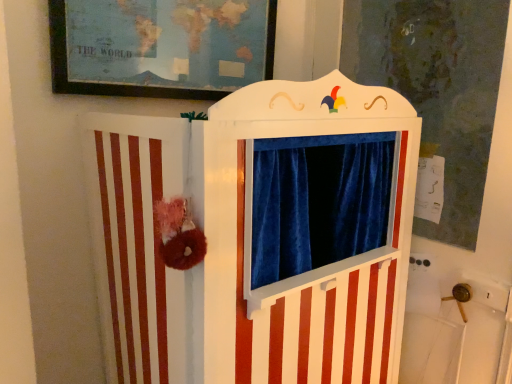
Question: Which is correct: white wood puppet theater at center is inside matte paper map at upper center, or outside of it?

Choices:
 (A) outside
 (B) inside

Answer: (A)

Question: Looking at the image, does white wood puppet theater at center seem bigger or smaller compared to matte paper map at upper center?

Choices:
 (A) big
 (B) small

Answer: (A)

Question: From the image's perspective, is white wood puppet theater at center positioned above or below matte paper map at upper center?

Choices:
 (A) below
 (B) above

Answer: (A)

Question: Considering the positions of point (217, 97) and point (393, 306), is point (217, 97) closer or farther from the camera than point (393, 306)?

Choices:
 (A) closer
 (B) farther

Answer: (A)

Question: Considering the positions of matte paper map at upper center and white wood puppet theater at center in the image, is matte paper map at upper center bigger or smaller than white wood puppet theater at center?

Choices:
 (A) small
 (B) big

Answer: (A)

Question: Relative to white wood puppet theater at center, is matte paper map at upper center in front or behind?

Choices:
 (A) behind
 (B) front

Answer: (A)

Question: Looking at their shapes, would you say matte paper map at upper center is wider or thinner than white wood puppet theater at center?

Choices:
 (A) thin
 (B) wide

Answer: (A)